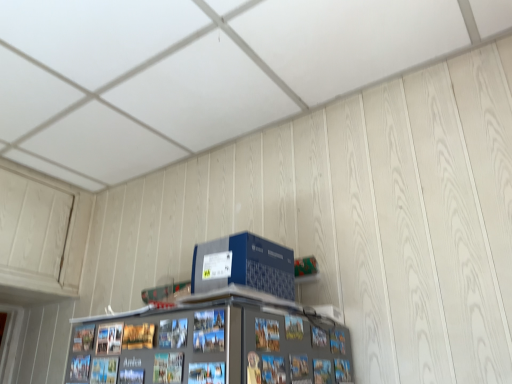
What do you see at coordinates (244, 265) in the screenshot? I see `blue matte computer at center` at bounding box center [244, 265].

Where is `blue matte computer at center`? This screenshot has width=512, height=384. blue matte computer at center is located at coordinates (244, 265).

What is the approximate height of blue matte computer at center?

The height of blue matte computer at center is 5.93 inches.

Measure the distance between blue matte computer at center and camera.

The depth of blue matte computer at center is 3.34 feet.

The image size is (512, 384). In order to click on blue matte computer at center in this screenshot , I will do `click(244, 265)`.